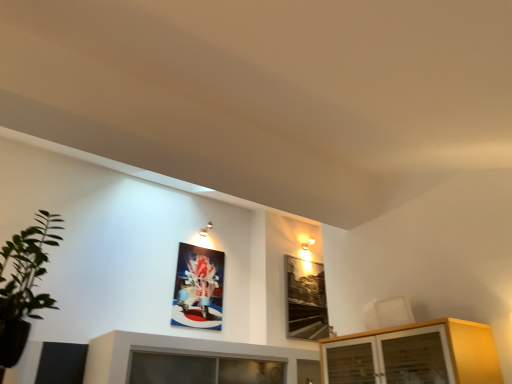
Question: In terms of size, does light wood cabinet at lower right appear bigger or smaller than metallic glossy picture frame at upper center, placed as the 2th picture frame when sorted from right to left?

Choices:
 (A) big
 (B) small

Answer: (A)

Question: Is point (336, 372) closer or farther from the camera than point (219, 263)?

Choices:
 (A) closer
 (B) farther

Answer: (A)

Question: Estimate the real-world distances between objects in this image. Which object is farther from the green leafy plant at left?

Choices:
 (A) black glass picture frame at upper right, positioned as the second picture frame in left-to-right order
 (B) metallic glossy picture frame at upper center, placed as the 2th picture frame when sorted from right to left
 (C) light wood cabinet at lower right

Answer: (A)

Question: Which object is positioned closest to the green leafy plant at left?

Choices:
 (A) black glass picture frame at upper right, which appears as the first picture frame when viewed from the right
 (B) light wood cabinet at lower right
 (C) metallic glossy picture frame at upper center, placed as the 2th picture frame when sorted from right to left

Answer: (C)